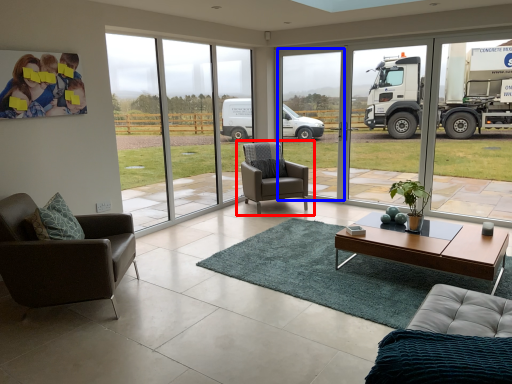
Question: Which point is closer to the camera, chair (highlighted by a red box) or window frame (highlighted by a blue box)?

Choices:
 (A) chair
 (B) window frame

Answer: (A)